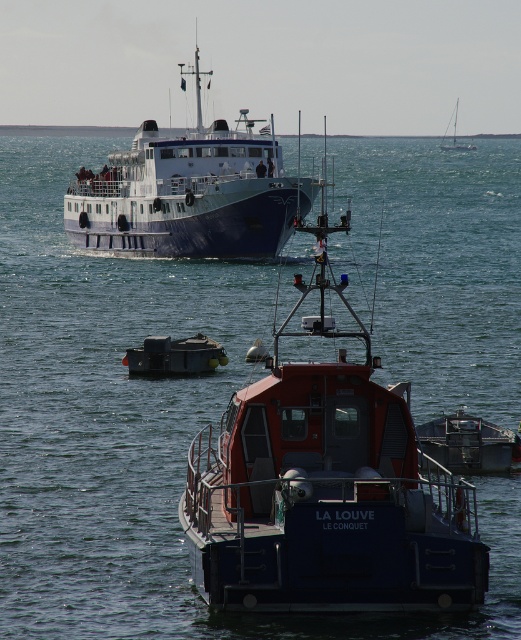
You are standing on the deck of the smaller red and blue boat named LA LOUVE from Le Conquet. You notice two points marked in the scene. Which of the two points, point (271, 129) or point (455, 120), is closer to you?

Point (271, 129) is closer to the viewer than point (455, 120).

You are a harbor master trying to dock two vessels. The blue matte ship at center and the white glossy sailboat at upper right are approaching the dock. Based on their sizes, which vessel should be assigned to the larger docking bay?

The blue matte ship at center is larger in size than the white glossy sailboat at upper right, so it should be assigned to the larger docking bay.

You are a sailor on the smaller boat named LA LOUVE. You need to navigate between two points marked on your map as point [218,358] and point [473,145]. Which point should you head towards first to stay closer to the ferry in the midground?

Point [218,358] is in front of point [473,145], so you should head towards point [218,358] first to stay closer to the ferry in the midground.